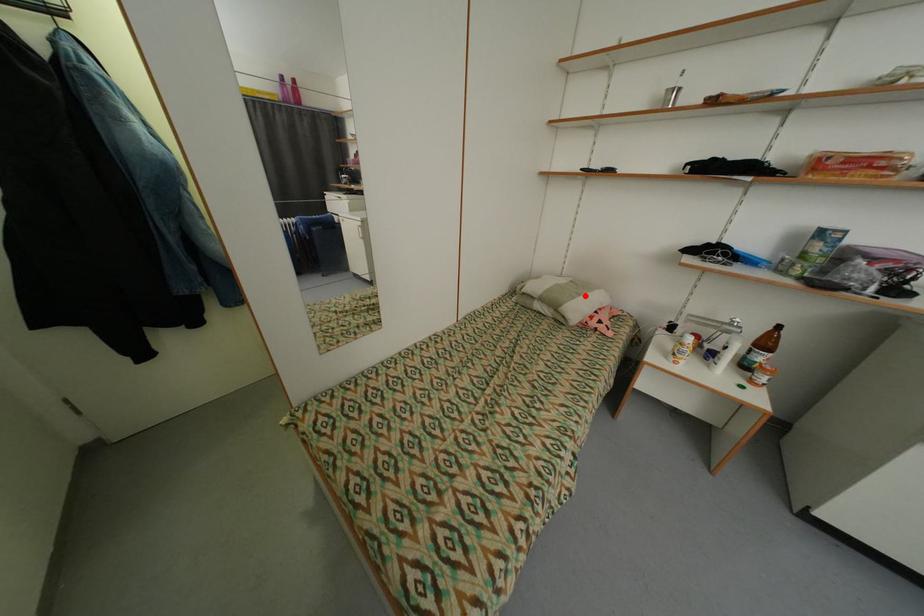
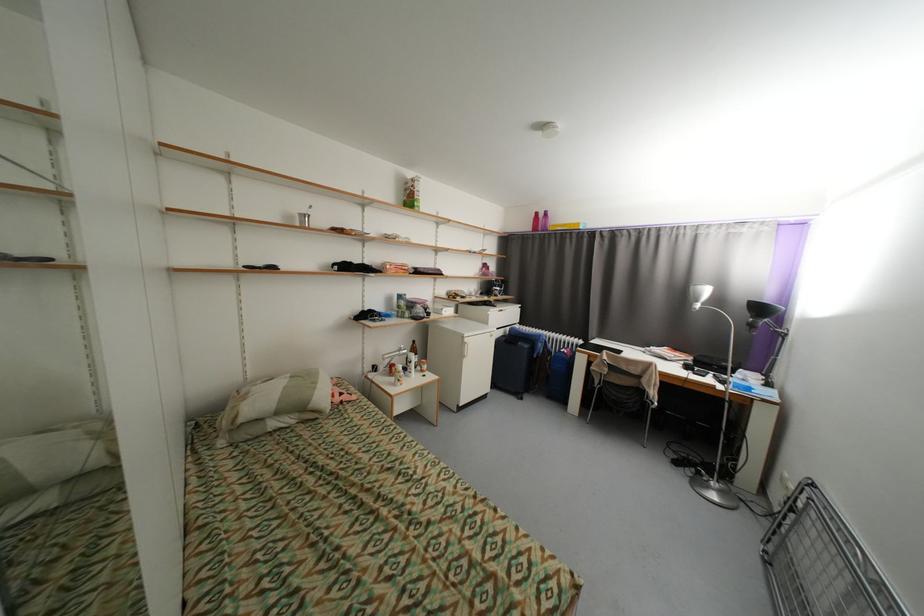
Where in the second image is the point corresponding to the highlighted location from the first image?

(322, 384)